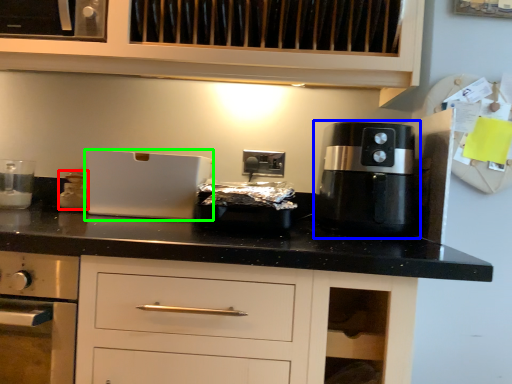
Question: Estimate the real-world distances between objects in this image. Which object is farther from kitchen appliance (highlighted by a red box), coffee machine (highlighted by a blue box) or appliance (highlighted by a green box)?

Choices:
 (A) coffee machine
 (B) appliance

Answer: (A)